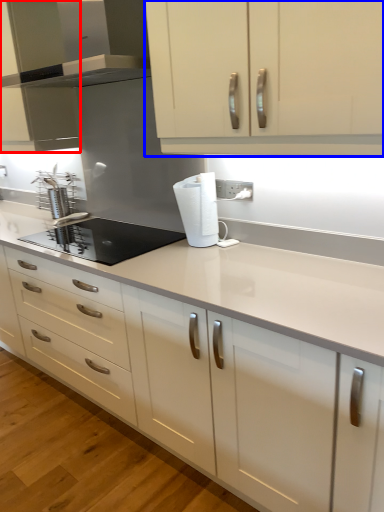
Question: Which object appears farthest to the camera in this image, cabinetry (highlighted by a red box) or cabinetry (highlighted by a blue box)?

Choices:
 (A) cabinetry
 (B) cabinetry

Answer: (A)